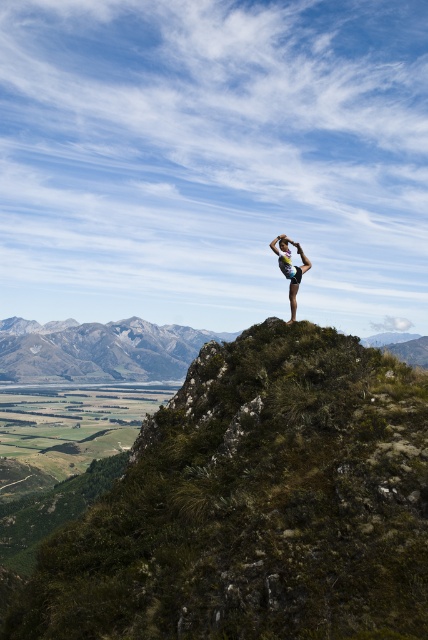
Question: Can you confirm if green grassy hillside at center is positioned below matte skin person at center?

Choices:
 (A) yes
 (B) no

Answer: (A)

Question: Is green grassy mountain at center wider than matte skin person at center?

Choices:
 (A) no
 (B) yes

Answer: (B)

Question: Which point is closer to the camera?

Choices:
 (A) matte skin person at center
 (B) green grassy mountain at center
 (C) green grassy hillside at center

Answer: (C)

Question: Estimate the real-world distances between objects in this image. Which object is farther from the green grassy hillside at center?

Choices:
 (A) matte skin person at center
 (B) green grassy mountain at center

Answer: (B)

Question: Is green grassy hillside at center above green grassy mountain at center?

Choices:
 (A) yes
 (B) no

Answer: (A)

Question: Which object is farther from the camera taking this photo?

Choices:
 (A) green grassy mountain at center
 (B) green grassy hillside at center

Answer: (A)